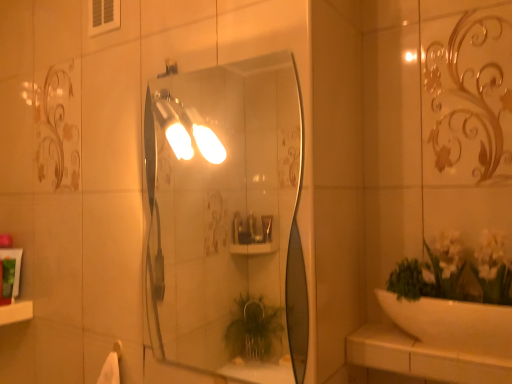
Question: Could white glossy ledge at lower left be considered to be inside green matte tube at left, marked as the first toiletry in a back-to-front arrangement?

Choices:
 (A) no
 (B) yes

Answer: (A)

Question: From the image's perspective, is green matte tube at left, acting as the second toiletry starting from the front, above white glossy ledge at lower left?

Choices:
 (A) yes
 (B) no

Answer: (A)

Question: Does green matte tube at left, marked as the first toiletry in a back-to-front arrangement, have a lesser width compared to white glossy ledge at lower left?

Choices:
 (A) yes
 (B) no

Answer: (A)

Question: Considering the relative sizes of green matte tube at left, acting as the second toiletry starting from the front, and white glossy ledge at lower left in the image provided, is green matte tube at left, acting as the second toiletry starting from the front, smaller than white glossy ledge at lower left?

Choices:
 (A) yes
 (B) no

Answer: (A)

Question: From a real-world perspective, is green matte tube at left, acting as the second toiletry starting from the front, under white glossy ledge at lower left?

Choices:
 (A) yes
 (B) no

Answer: (B)

Question: From a real-world perspective, relative to white glossy ledge at lower left, is green matte tube at left, acting as the second toiletry starting from the front, vertically above or below?

Choices:
 (A) below
 (B) above

Answer: (B)

Question: Is point (3, 241) closer or farther from the camera than point (8, 314)?

Choices:
 (A) closer
 (B) farther

Answer: (B)

Question: Is green matte tube at left, acting as the second toiletry starting from the front, to the left or to the right of white glossy ledge at lower left in the image?

Choices:
 (A) right
 (B) left

Answer: (A)

Question: Is green matte tube at left, marked as the first toiletry in a back-to-front arrangement, taller or shorter than white glossy ledge at lower left?

Choices:
 (A) short
 (B) tall

Answer: (B)

Question: In the image, is green matte tube at left, the 1th toiletry in the front-to-back sequence, positioned in front of or behind matte glass mirror at center?

Choices:
 (A) behind
 (B) front

Answer: (A)

Question: From a real-world perspective, relative to matte glass mirror at center, is green matte tube at left, the 1th toiletry in the front-to-back sequence, vertically above or below?

Choices:
 (A) above
 (B) below

Answer: (B)

Question: Considering the relative positions of green matte tube at left, the second toiletry positioned from the back, and matte glass mirror at center in the image provided, is green matte tube at left, the second toiletry positioned from the back, to the left or to the right of matte glass mirror at center?

Choices:
 (A) left
 (B) right

Answer: (A)

Question: Looking at the image, does green matte tube at left, the second toiletry positioned from the back, seem bigger or smaller compared to matte glass mirror at center?

Choices:
 (A) big
 (B) small

Answer: (B)

Question: Considering the positions of white glossy ledge at lower left and white ceramic counter top at lower right in the image, is white glossy ledge at lower left wider or thinner than white ceramic counter top at lower right?

Choices:
 (A) wide
 (B) thin

Answer: (A)

Question: From the image's perspective, is white glossy ledge at lower left above or below white ceramic counter top at lower right?

Choices:
 (A) below
 (B) above

Answer: (A)